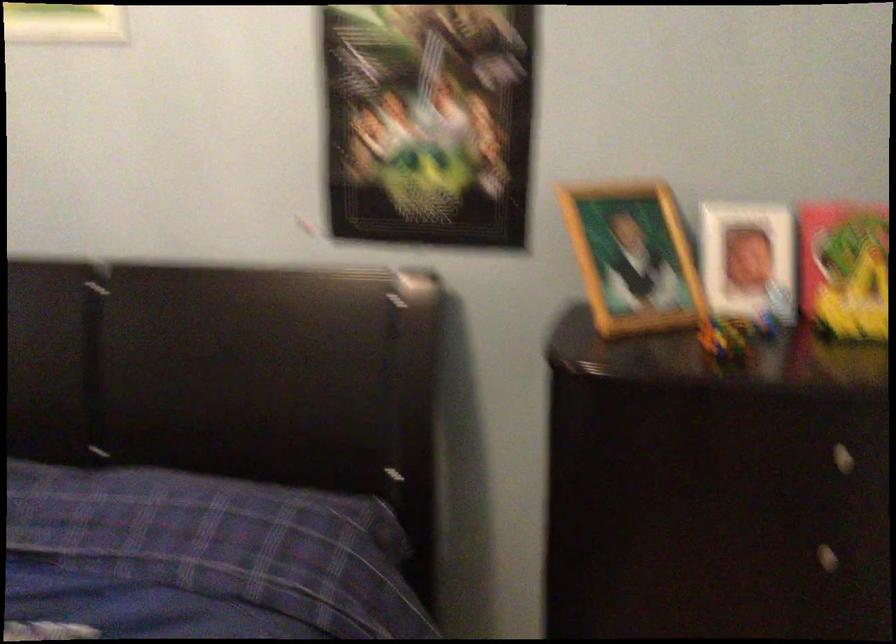
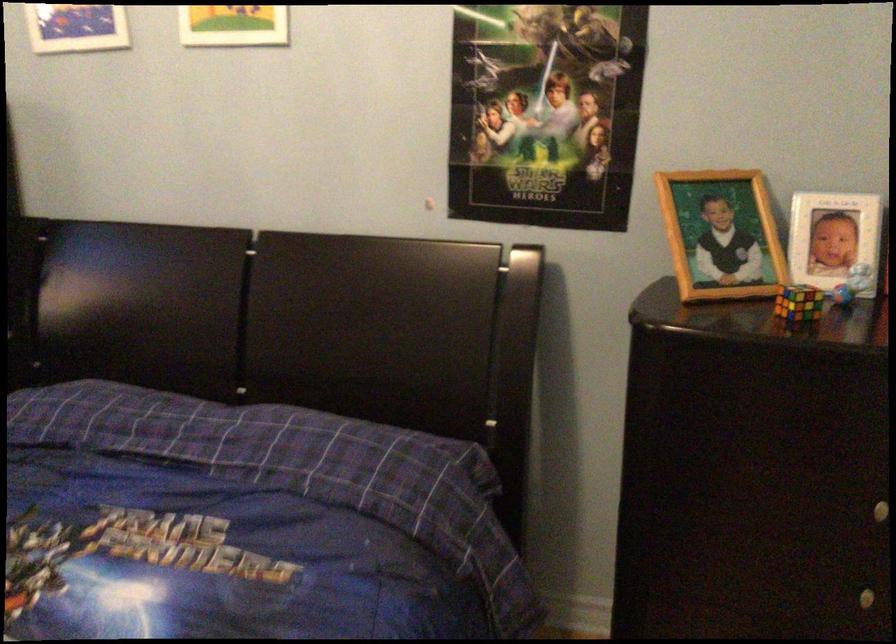
Locate, in the second image, the point that corresponds to (629,252) in the first image.

(720, 234)